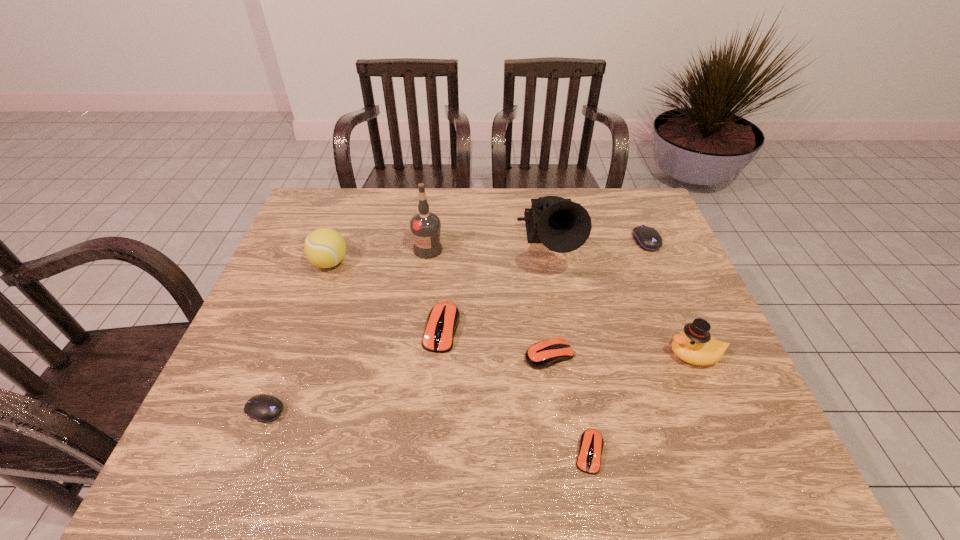
Where is `computer mouse located in the right edge section of the desktop`? Image resolution: width=960 pixels, height=540 pixels. computer mouse located in the right edge section of the desktop is located at coordinates (647, 238).

What are the coordinates of `object present at the far right corner` in the screenshot? It's located at (647, 238).

Where is `vacant point at the far edge`? vacant point at the far edge is located at coordinates (443, 191).

The image size is (960, 540). Find the location of `blank area at the near edge`. blank area at the near edge is located at coordinates (300, 440).

Locate an element on the screen. The height and width of the screenshot is (540, 960). blank area at the left edge is located at coordinates (274, 341).

The height and width of the screenshot is (540, 960). What are the coordinates of `vacant space at the right edge of the desktop` in the screenshot? It's located at (668, 310).

I want to click on free space between the yellow tennis ball and the vodka, so click(x=379, y=256).

Locate an element on the screen. The height and width of the screenshot is (540, 960). unoccupied position between the vodka and the duck is located at coordinates (562, 302).

Find the location of a particular element. The height and width of the screenshot is (540, 960). free space that is in between the tennis ball and the yellow duck is located at coordinates [x=513, y=309].

I want to click on empty space between the second smallest orange computer mouse and the biggest orange computer mouse, so click(x=495, y=342).